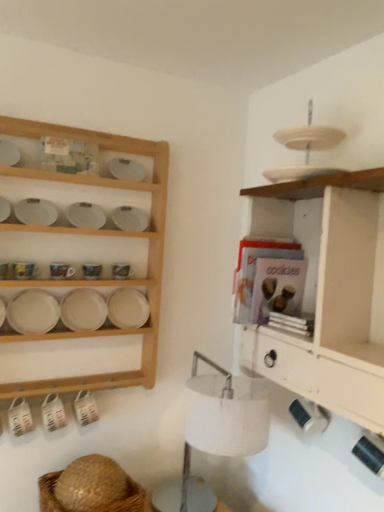
Image resolution: width=384 pixels, height=512 pixels. What do you see at coordinates (103, 234) in the screenshot?
I see `white wood shelf at upper left, the first shelf from the left` at bounding box center [103, 234].

What are the coordinates of `white wood shelf at upper left, the 2th shelf viewed from the right` in the screenshot? It's located at (103, 234).

Where is `white wood shelf at right, the second shelf when ordered from left to right`? The width and height of the screenshot is (384, 512). white wood shelf at right, the second shelf when ordered from left to right is located at coordinates (329, 297).

Identify the location of brown woven basket at lower left. (127, 500).

Considering the positions of points (371, 311) and (39, 501), is point (371, 311) closer to camera compared to point (39, 501)?

Yes.

Between white wood shelf at right, the second shelf when ordered from left to right, and brown woven basket at lower left, which one has larger width?

Wider between the two is brown woven basket at lower left.

How many degrees apart are the facing directions of white wood shelf at right, the first shelf viewed from the right, and brown woven basket at lower left?

They differ by 91.6 degrees in their facing directions.

How much distance is there between white wood shelf at right, the second shelf when ordered from left to right, and brown woven basket at lower left?

white wood shelf at right, the second shelf when ordered from left to right, is 31.55 inches away from brown woven basket at lower left.

Considering the relative positions of white matte platter at left and white wood shelf at upper left, the 2th shelf viewed from the right, in the image provided, is white matte platter at left to the left of white wood shelf at upper left, the 2th shelf viewed from the right, from the viewer's perspective?

Yes, white matte platter at left is to the left of white wood shelf at upper left, the 2th shelf viewed from the right.

From a real-world perspective, who is located lower, white matte platter at left or white wood shelf at upper left, the 2th shelf viewed from the right?

white matte platter at left, from a real-world perspective.

In the scene shown: Would you consider white matte platter at left to be distant from white wood shelf at upper left, the first shelf from the left?

Actually, white matte platter at left and white wood shelf at upper left, the first shelf from the left, are a little close together.

You are a GUI agent. You are given a task and a screenshot of the screen. Output one action in this format:
    pyautogui.click(x=<x>, y=<y>)
    Task: Click on the platter below the white wood shelf at upper left, the 2th shelf viewed from the right (from a real-world perspective)
    
    Given the screenshot: What is the action you would take?
    pyautogui.click(x=33, y=312)

Which is more to the right, white matte platter at left or white fabric lampshade at center?

From the viewer's perspective, white fabric lampshade at center appears more on the right side.

Is point (40, 314) closer to camera compared to point (268, 392)?

No, it is not.

Is white matte platter at left spatially inside white fabric lampshade at center, or outside of it?

white matte platter at left is located beyond the bounds of white fabric lampshade at center.

From the image's perspective, is white matte platter at left positioned above or below white fabric lampshade at center?

white matte platter at left is situated higher than white fabric lampshade at center in the image.

Considering the relative sizes of white fabric lampshade at center and brown woven basket at lower left in the image provided, is white fabric lampshade at center bigger than brown woven basket at lower left?

Yes, white fabric lampshade at center is bigger than brown woven basket at lower left.

Is white fabric lampshade at center touching brown woven basket at lower left?

They are not placed beside each other.

Considering the relative positions of white fabric lampshade at center and brown woven basket at lower left in the image provided, is white fabric lampshade at center to the left of brown woven basket at lower left from the viewer's perspective?

In fact, white fabric lampshade at center is to the right of brown woven basket at lower left.

In the scene shown: How different are the orientations of white fabric lampshade at center and brown woven basket at lower left in degrees?

The angle between the facing direction of white fabric lampshade at center and the facing direction of brown woven basket at lower left is 0.79 degrees.

From the picture: Between white wood shelf at right, the second shelf when ordered from left to right, and white matte platter at left, which one has larger size?

Bigger between the two is white wood shelf at right, the second shelf when ordered from left to right.

Does point (375, 412) lie in front of point (48, 297)?

Yes, point (375, 412) is closer to viewer.

From the image's perspective, which one is positioned higher, white wood shelf at right, the second shelf when ordered from left to right, or white matte platter at left?

From the image's view, white wood shelf at right, the second shelf when ordered from left to right, is above.

Considering the relative positions of white wood shelf at upper left, the first shelf from the left, and white matte platter at left in the image provided, is white wood shelf at upper left, the first shelf from the left, to the left of white matte platter at left from the viewer's perspective?

Incorrect, white wood shelf at upper left, the first shelf from the left, is not on the left side of white matte platter at left.

Is white wood shelf at upper left, the first shelf from the left, facing away from white matte platter at left?

Absolutely, white wood shelf at upper left, the first shelf from the left, is directed away from white matte platter at left.

Who is bigger, white wood shelf at upper left, the first shelf from the left, or white matte platter at left?

Bigger between the two is white wood shelf at upper left, the first shelf from the left.

Based on the photo, from a real-world perspective, is white wood shelf at upper left, the 2th shelf viewed from the right, located beneath white matte platter at left?

Actually, white wood shelf at upper left, the 2th shelf viewed from the right, is physically above white matte platter at left in the real world.

Could you measure the distance between white fabric lampshade at center and white wood shelf at right, the first shelf viewed from the right?

A distance of 13.02 inches exists between white fabric lampshade at center and white wood shelf at right, the first shelf viewed from the right.

From a real-world perspective, which object rests below the other?

white fabric lampshade at center is physically lower.

Is white fabric lampshade at center outside of white wood shelf at right, the second shelf when ordered from left to right?

Indeed, white fabric lampshade at center is completely outside white wood shelf at right, the second shelf when ordered from left to right.

Is white fabric lampshade at center wider than white wood shelf at right, the first shelf viewed from the right?

Indeed, white fabric lampshade at center has a greater width compared to white wood shelf at right, the first shelf viewed from the right.

There is a brown woven basket at lower left. Identify the location of the 1st shelf above it (from the image's perspective). (329, 297).

The width and height of the screenshot is (384, 512). I want to click on shelf that is the 1st object located in front of the white matte platter at left, so click(x=103, y=234).

Based on their spatial positions, is white wood shelf at right, the second shelf when ordered from left to right, or white fabric lampshade at center further from white matte platter at left?

white wood shelf at right, the second shelf when ordered from left to right, is positioned further to the anchor white matte platter at left.

Based on their spatial positions, is brown woven basket at lower left or white wood shelf at right, the second shelf when ordered from left to right, further from white wood shelf at upper left, the 2th shelf viewed from the right?

white wood shelf at right, the second shelf when ordered from left to right, is further to white wood shelf at upper left, the 2th shelf viewed from the right.

Considering their positions, is brown woven basket at lower left positioned closer to white matte platter at left than white wood shelf at upper left, the 2th shelf viewed from the right?

Based on the image, white wood shelf at upper left, the 2th shelf viewed from the right, appears to be nearer to white matte platter at left.

Which object lies nearer to the anchor point white matte platter at left, white fabric lampshade at center or white wood shelf at upper left, the 2th shelf viewed from the right?

white wood shelf at upper left, the 2th shelf viewed from the right.

Which object lies further to the anchor point brown woven basket at lower left, white wood shelf at upper left, the 2th shelf viewed from the right, or white matte platter at left?

Based on the image, white wood shelf at upper left, the 2th shelf viewed from the right, appears to be further to brown woven basket at lower left.

From the image, which object appears to be nearer to white wood shelf at upper left, the first shelf from the left, white fabric lampshade at center or white matte platter at left?

The object closer to white wood shelf at upper left, the first shelf from the left, is white matte platter at left.

When comparing their distances from white wood shelf at right, the second shelf when ordered from left to right, does white matte platter at left or white fabric lampshade at center seem further?

white matte platter at left.

From the image, which object appears to be nearer to white wood shelf at upper left, the 2th shelf viewed from the right, white matte platter at left or brown woven basket at lower left?

white matte platter at left is closer to white wood shelf at upper left, the 2th shelf viewed from the right.

Locate an element on the screen. Image resolution: width=384 pixels, height=512 pixels. lamp between white matte platter at left and brown woven basket at lower left vertically is located at coordinates (215, 432).

Find the location of a particular element. This screenshot has height=512, width=384. lamp between white wood shelf at upper left, the 2th shelf viewed from the right, and white wood shelf at right, the first shelf viewed from the right, from left to right is located at coordinates (215, 432).

At what (x,y) coordinates should I click in order to perform the action: click on lamp situated between brown woven basket at lower left and white wood shelf at right, the second shelf when ordered from left to right, from left to right. Please return your answer as a coordinate pair (x, y). Image resolution: width=384 pixels, height=512 pixels. Looking at the image, I should click on (215, 432).

Locate an element on the screen. lamp located between white matte platter at left and white wood shelf at right, the first shelf viewed from the right, in the left-right direction is located at coordinates (215, 432).